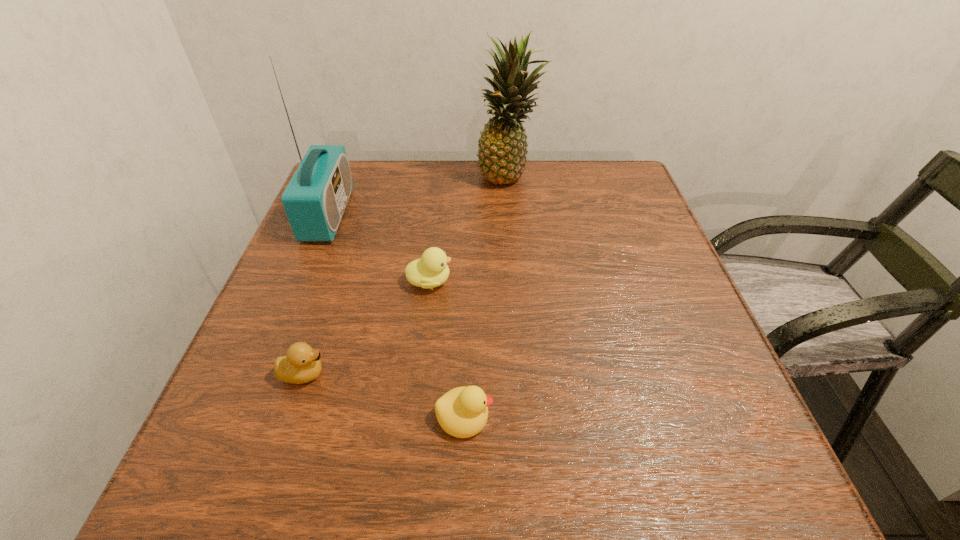
Where is `unoccupied area between the third farthest object and the fourth farthest object`? unoccupied area between the third farthest object and the fourth farthest object is located at coordinates (367, 327).

Where is `free area in between the nearest object and the pineapple`? The height and width of the screenshot is (540, 960). free area in between the nearest object and the pineapple is located at coordinates (486, 296).

This screenshot has height=540, width=960. What are the coordinates of `vacant area that lies between the pineapple and the leftmost duckling` in the screenshot? It's located at (406, 275).

Select which object appears as the third closest to the pineapple. Please provide its 2D coordinates. Your answer should be formatted as a tuple, i.e. [(x, y)], where the tuple contains the x and y coordinates of a point satisfying the conditions above.

[(302, 364)]

This screenshot has height=540, width=960. In order to click on object that can be found as the second closest to the nearest duckling in this screenshot , I will do `click(431, 270)`.

In order to click on duckling that stands as the closest to the pineapple in this screenshot , I will do `click(431, 270)`.

Locate an element on the screen. duckling that stands as the second closest to the farthest duckling is located at coordinates (462, 412).

Locate an element on the screen. Image resolution: width=960 pixels, height=540 pixels. vacant space that satisfies the following two spatial constraints: 1. on the front side of the pineapple; 2. at the beak of the third farthest object is located at coordinates (517, 281).